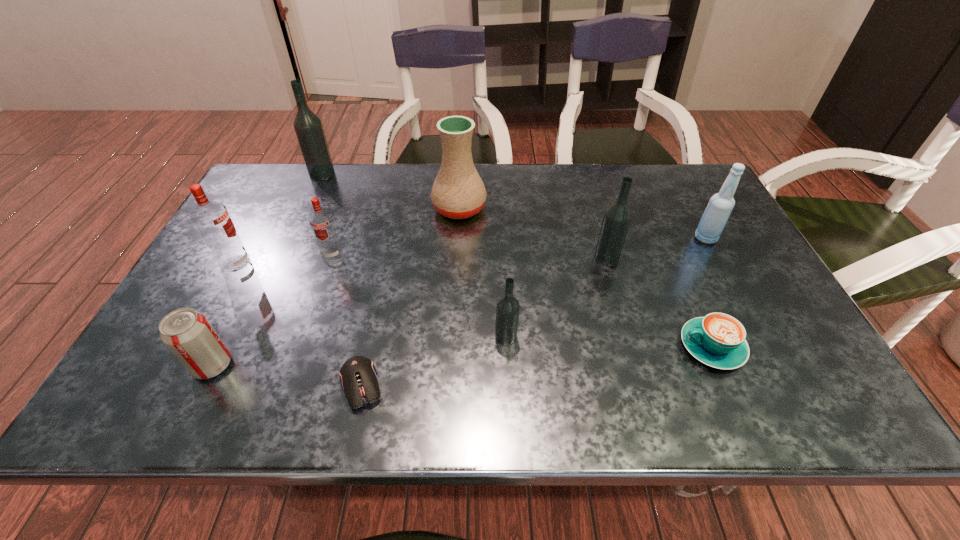
Locate an element on the screen. object that is positioned at the near left corner is located at coordinates (187, 333).

In the image, there is a desktop. Identify the location of vacant space at the far edge. The width and height of the screenshot is (960, 540). (625, 174).

In order to click on vacant space at the left edge of the desktop in this screenshot , I will do tap(153, 368).

Find the location of a particular element. This screenshot has height=540, width=960. free space at the right edge of the desktop is located at coordinates (789, 376).

Where is `vacant region at the far left corner`? Image resolution: width=960 pixels, height=540 pixels. vacant region at the far left corner is located at coordinates (271, 199).

The height and width of the screenshot is (540, 960). In order to click on vacant space at the far right corner in this screenshot , I will do `click(669, 188)`.

Locate an element on the screen. Image resolution: width=960 pixels, height=540 pixels. free spot between the black computer mouse and the right red vodka is located at coordinates (347, 320).

Locate an element on the screen. This screenshot has height=540, width=960. free space between the third vodka from right to left and the sixth object from right to left is located at coordinates click(347, 320).

Where is `empty space between the sixth object from right to left and the second farthest object`? empty space between the sixth object from right to left and the second farthest object is located at coordinates (411, 296).

Where is `free space between the farthest vodka and the bottle`? free space between the farthest vodka and the bottle is located at coordinates (514, 206).